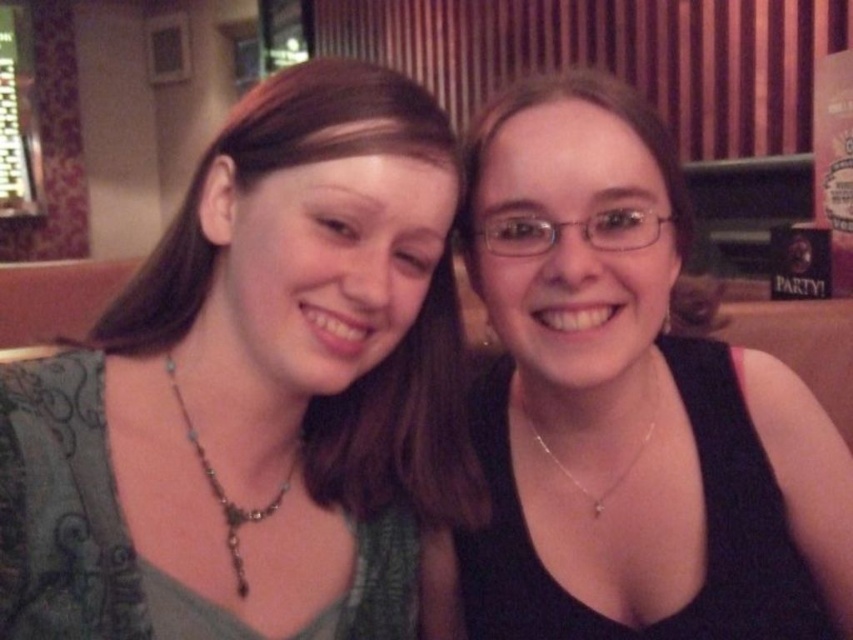
Question: From the image, what is the correct spatial relationship of silver beaded necklace at left in relation to silver chain necklace at center?

Choices:
 (A) right
 (B) left

Answer: (B)

Question: Is silver beaded necklace at left positioned before silver chain necklace at center?

Choices:
 (A) yes
 (B) no

Answer: (A)

Question: Which point appears closest to the camera in this image?

Choices:
 (A) (512, 627)
 (B) (614, 490)

Answer: (A)

Question: Estimate the real-world distances between objects in this image. Which object is closer to the silver beaded necklace at left?

Choices:
 (A) black matte tank top at right
 (B) green fabric top at left

Answer: (B)

Question: Is silver beaded necklace at left thinner than silver chain necklace at center?

Choices:
 (A) yes
 (B) no

Answer: (A)

Question: Which object is farther from the camera taking this photo?

Choices:
 (A) silver beaded necklace at left
 (B) silver chain necklace at center
 (C) black matte tank top at right
 (D) green fabric top at left

Answer: (B)